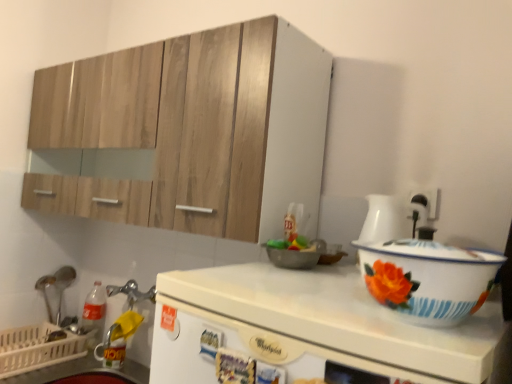
Question: In terms of height, does white enamel basin at right look taller or shorter compared to white glossy whirlpool at center?

Choices:
 (A) short
 (B) tall

Answer: (A)

Question: Which is correct: white enamel basin at right is inside white glossy whirlpool at center, or outside of it?

Choices:
 (A) inside
 (B) outside

Answer: (B)

Question: Based on their relative distances, which object is nearer to the white glossy counter top at lower left?

Choices:
 (A) brushed metal spoon at left
 (B) wooden cabinet at upper left
 (C) white glossy whirlpool at center
 (D) white enamel basin at right

Answer: (A)

Question: Based on their relative distances, which object is farther from the white glossy counter top at lower left?

Choices:
 (A) white glossy whirlpool at center
 (B) white enamel basin at right
 (C) brushed metal spoon at left
 (D) wooden cabinet at upper left

Answer: (B)